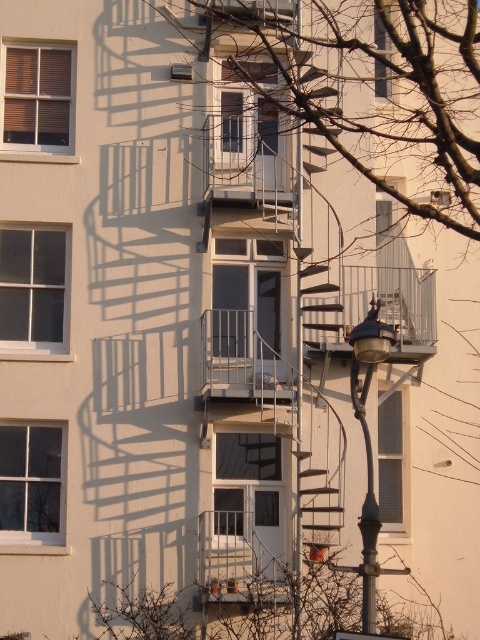
Question: Which of the following is the closest to the observer?

Choices:
 (A) (60, 323)
 (B) (38, 451)
 (C) (228, 112)

Answer: (B)

Question: Can you confirm if bare branches at center is positioned above metallic spiral staircase at center?

Choices:
 (A) yes
 (B) no

Answer: (A)

Question: Is transparent glass door at center in front of metallic spiral staircase at center?

Choices:
 (A) no
 (B) yes

Answer: (A)

Question: Which of the following is the closest to the observer?

Choices:
 (A) clear glass window at upper left
 (B) bare branches at center
 (C) metallic silver balcony at center
 (D) transparent glass door at center

Answer: (B)

Question: Can you confirm if transparent glass door at center is positioned to the right of clear glass window at center?

Choices:
 (A) no
 (B) yes

Answer: (A)

Question: Which object is closer to the camera taking this photo?

Choices:
 (A) matte glass window at upper center
 (B) metallic spiral staircase at center
 (C) clear glass window at upper left
 (D) metallic silver balcony at center

Answer: (D)